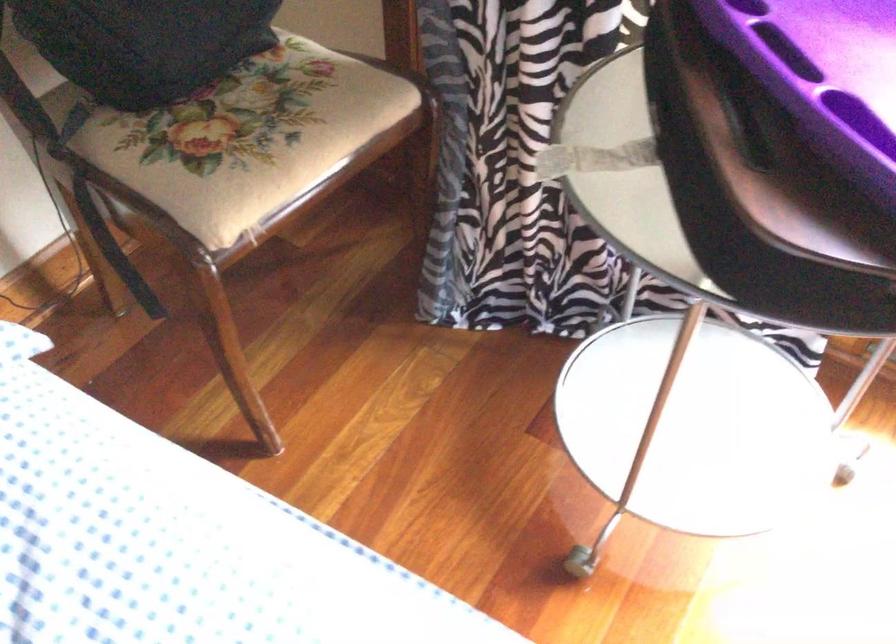
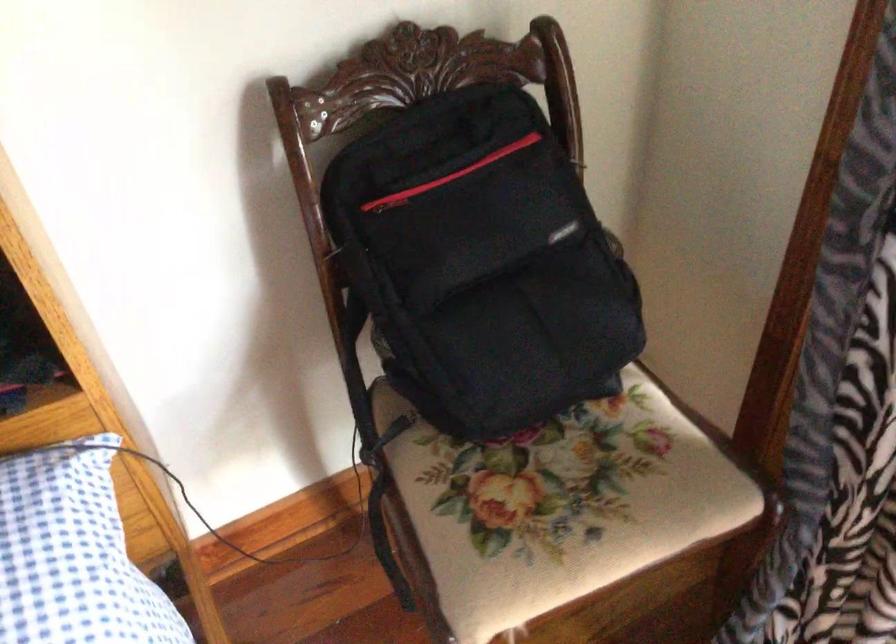
Question: How did the camera likely rotate?

Choices:
 (A) Left
 (B) Right
 (C) Up
 (D) Down

Answer: (A)